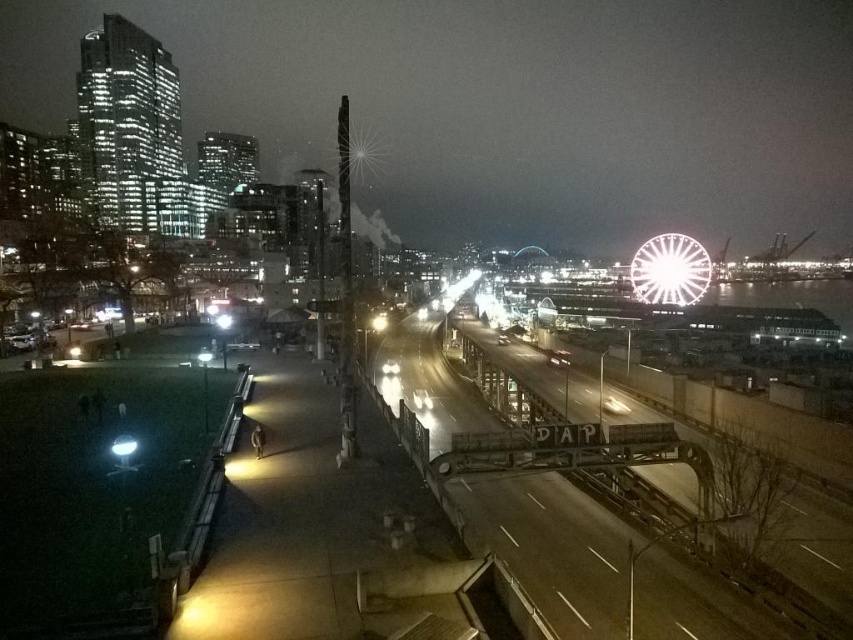
You are standing at the elevated vantage point overlooking the city. You notice two points marked in the image. Which point is closer to you, point 1 at coordinates (509, 516) or point 2 at coordinates (683, 236)?

Point 1 at coordinates (509, 516) is closer to you than point 2 at coordinates (683, 236).

You are a photographer standing on the pedestrian walkway and want to capture a photo that includes both the metallic gray train track at center and the white metallic ferris wheel at right. Based on their positions, which object should you frame first in your camera viewfinder to ensure both are in the shot?

The metallic gray train track at center is positioned on the left side of the white metallic ferris wheel at right. To include both in the photo, you should frame the metallic gray train track at center first since it is on the left side of the white metallic ferris wheel at right, ensuring both are within the camera viewfinder.